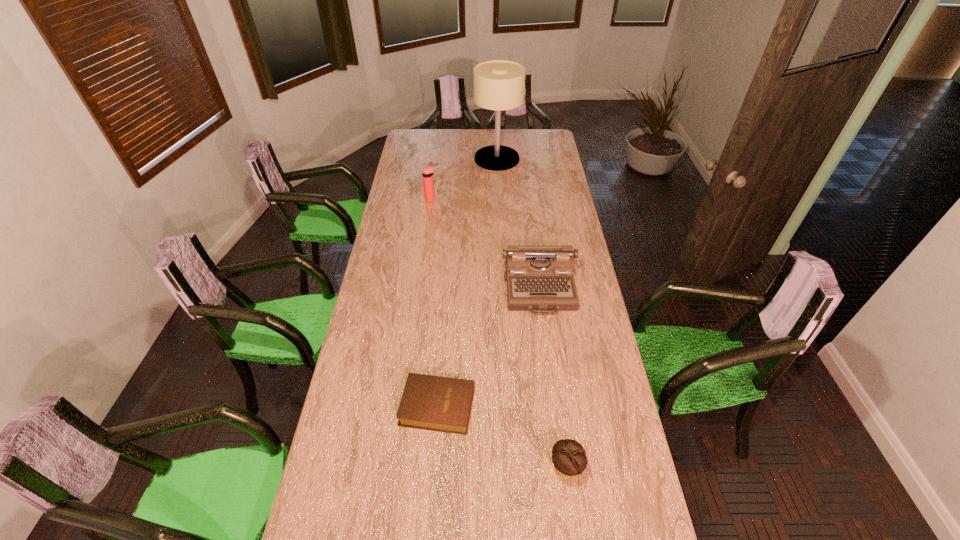
Identify which object is the nearest to the farthest object. Please provide its 2D coordinates. Your answer should be formatted as a tuple, i.e. [(x, y)], where the tuple contains the x and y coordinates of a point satisfying the conditions above.

[(428, 171)]

Find the location of a particular element. vacant region that satisfies the following two spatial constraints: 1. on the front side of the nearest object; 2. on the left side of the fourth nearest object is located at coordinates (395, 467).